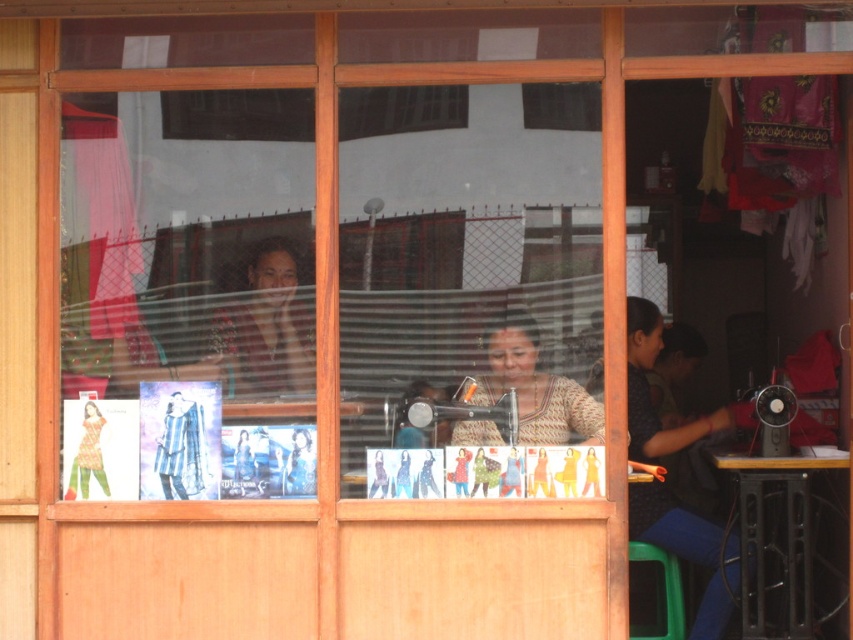
You are a customer looking at the fabric samples displayed on the window sill of the sewing workshop. You notice the matte brown shirt at center and the green plastic stool at lower right. Which object is larger in size?

The green plastic stool at lower right is larger than the matte brown shirt at center.

You are standing at point (277, 296) and want to reach the entrance of the sewing workshop. The entrance is located at the opposite corner of the window. If the distance between you and the entrance is 6.04 meters, can you reach it in 10 seconds if you walk at a speed of 1.2 m per second?

Yes, because 1.2 m per second multiplied by 10 seconds equals 12 meters, which is more than the required 6.04 meters to reach the entrance.

You are a customer standing at the entrance of the sewing workshop. You want to pick up the matte brown shirt at center and place it on the green plastic stool at lower right. Can you do this without moving more than 1.5 meters from your current position?

The matte brown shirt at center is 1.48 meters away from the green plastic stool at lower right. Since the distance is less than 1.5 meters, you can pick up the shirt and place it on the stool without exceeding the distance limit.